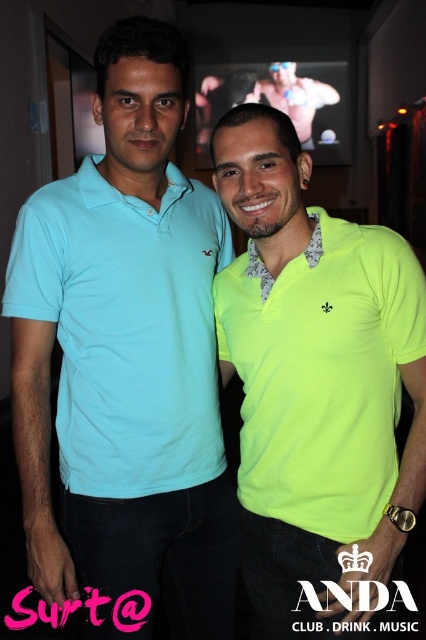
You are a photographer trying to capture a candid shot of the two people in the scene. The camera you are using has a maximum focus range of 7 meters. Can you focus on both the matte light blue polo shirt at left and the muscular skin at upper center simultaneously?

The distance between the matte light blue polo shirt at left and muscular skin at upper center is 7.29 meters, which exceeds the camera maximum focus range of 7 meters. Therefore, you cannot focus on both simultaneously.

You are standing in the venue and want to take a photo of the point at coordinates (210, 624). The camera you have can focus on objects up to 1.5 meters away. Will the point be in focus?

The point at coordinates (210, 624) is 1.43 meters away from the viewer, so yes, it will be within the camera focus range of up to 1.5 meters.

You are taking a photo of two people at a social event. The first person is wearing a light teal polo shirt and is at point [333,525]. The second person is in a bright neon yellow polo shirt and at point [261,92]. Which of these two points is closer to the camera?

Point [333,525] is closer to the camera than point [261,92].